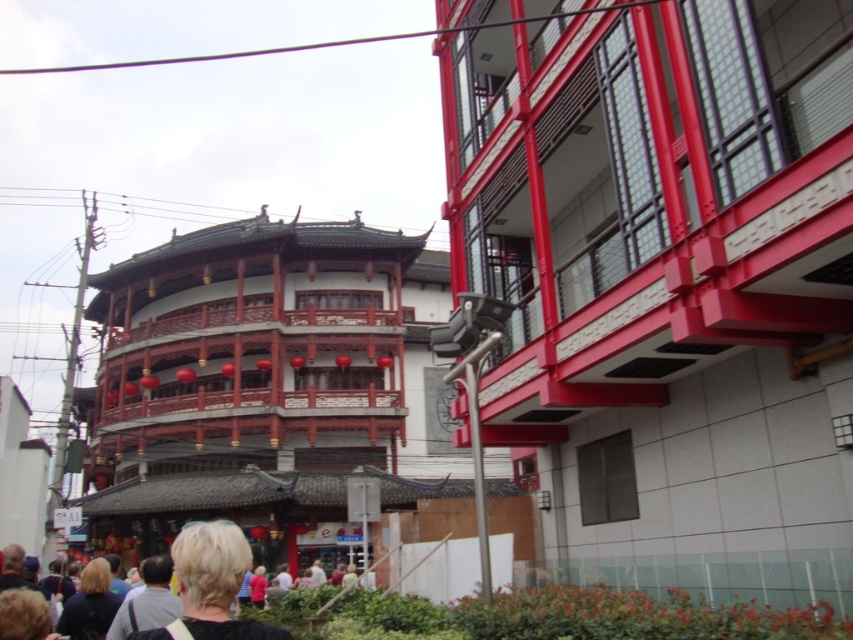
Between smooth red building at center and blonde hair at lower left, which one appears on the right side from the viewer's perspective?

smooth red building at center is more to the right.

The image size is (853, 640). What are the coordinates of `smooth red building at center` in the screenshot? It's located at (664, 280).

What are the coordinates of `smooth red building at center` in the screenshot? It's located at (664, 280).